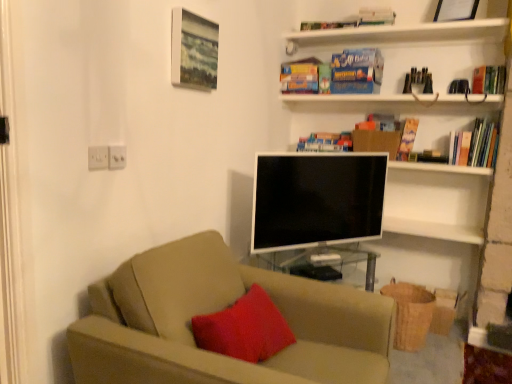
Question: Is hardcover book at upper right, the 2th book from the bottom, to the right of blue matte bookshelf at upper center, the fourth book positioned from the right, from the viewer's perspective?

Choices:
 (A) no
 (B) yes

Answer: (B)

Question: Considering the relative sizes of hardcover book at upper right, marked as the 3th book in a top-to-bottom arrangement, and blue matte bookshelf at upper center, the fourth book positioned from the right, in the image provided, is hardcover book at upper right, marked as the 3th book in a top-to-bottom arrangement, taller than blue matte bookshelf at upper center, the fourth book positioned from the right,?

Choices:
 (A) yes
 (B) no

Answer: (A)

Question: Can blue matte bookshelf at upper center, the first book from the left, be found inside hardcover book at upper right, which is the first book from right to left?

Choices:
 (A) yes
 (B) no

Answer: (B)

Question: From a real-world perspective, is hardcover book at upper right, the 2th book from the bottom, positioned under blue matte bookshelf at upper center, positioned as the 1th book in bottom-to-top order, based on gravity?

Choices:
 (A) yes
 (B) no

Answer: (B)

Question: From the image's perspective, is hardcover book at upper right, marked as the 3th book in a top-to-bottom arrangement, beneath blue matte bookshelf at upper center, the fourth book positioned from the right?

Choices:
 (A) no
 (B) yes

Answer: (A)

Question: Considering the positions of blue cardboard paperback book at upper center, which is the 2th paperback book from left to right, and hardcover book at upper center, the first paperback book in the left-to-right sequence, in the image, is blue cardboard paperback book at upper center, which is the 2th paperback book from left to right, wider or thinner than hardcover book at upper center, the first paperback book in the left-to-right sequence,?

Choices:
 (A) wide
 (B) thin

Answer: (A)

Question: Is blue cardboard paperback book at upper center, which is the 2th paperback book from left to right, situated inside hardcover book at upper center, the first paperback book in the left-to-right sequence, or outside?

Choices:
 (A) inside
 (B) outside

Answer: (B)

Question: Considering the positions of point (353, 66) and point (303, 84), is point (353, 66) closer or farther from the camera than point (303, 84)?

Choices:
 (A) farther
 (B) closer

Answer: (B)

Question: From a real-world perspective, relative to hardcover book at upper center, placed as the 3th paperback book when sorted from right to left, is blue cardboard paperback book at upper center, the second paperback book when ordered from right to left, vertically above or below?

Choices:
 (A) above
 (B) below

Answer: (A)

Question: From the image's perspective, relative to wooden picture frame at upper right, which appears as the 1th picture frame when viewed from the top, is blue cardboard paperback book at upper center, which is the 2th paperback book from left to right, above or below?

Choices:
 (A) below
 (B) above

Answer: (A)

Question: In the image, is blue cardboard paperback book at upper center, which is the 2th paperback book from left to right, positioned in front of or behind wooden picture frame at upper right, which is counted as the second picture frame, starting from the left?

Choices:
 (A) behind
 (B) front

Answer: (A)

Question: Is blue cardboard paperback book at upper center, which is the 2th paperback book from left to right, taller or shorter than wooden picture frame at upper right, the 2th picture frame positioned from the bottom?

Choices:
 (A) short
 (B) tall

Answer: (B)

Question: Based on their sizes in the image, would you say blue cardboard paperback book at upper center, which is the 2th paperback book from left to right, is bigger or smaller than wooden picture frame at upper right, which is the 1th picture frame in right-to-left order?

Choices:
 (A) big
 (B) small

Answer: (A)

Question: Based on their sizes in the image, would you say beige fabric couch at center is bigger or smaller than hardcover book at upper right, acting as the third paperback book starting from the left?

Choices:
 (A) small
 (B) big

Answer: (B)

Question: From a real-world perspective, is beige fabric couch at center physically located above or below hardcover book at upper right, arranged as the first paperback book when viewed from the right?

Choices:
 (A) above
 (B) below

Answer: (B)